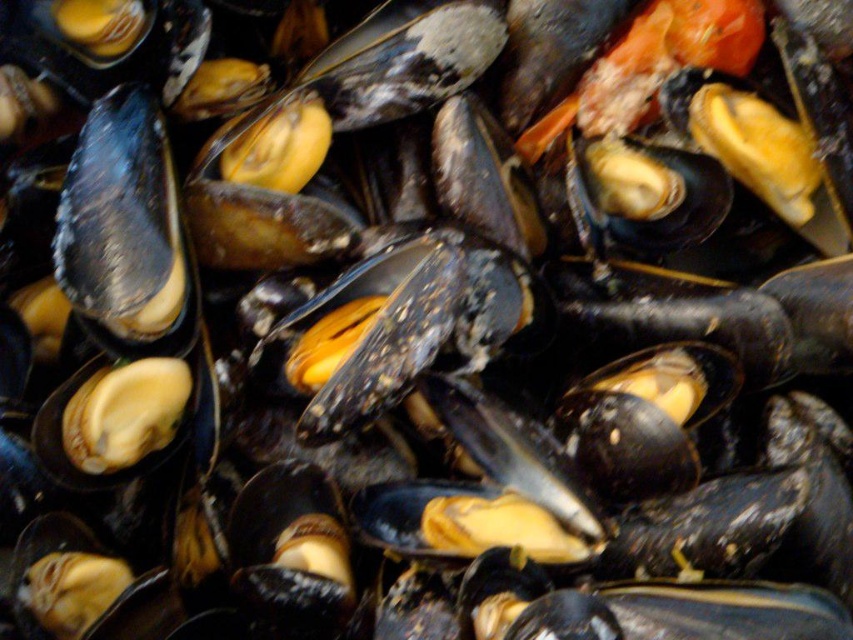
Question: Can you confirm if matte black mussel at upper left is smaller than matte yellow shell at center?

Choices:
 (A) no
 (B) yes

Answer: (A)

Question: Which object appears farthest from the camera in this image?

Choices:
 (A) matte yellow shell at center
 (B) matte black mussel at upper left

Answer: (A)

Question: Which point is closer to the camera?

Choices:
 (A) matte black mussel at upper left
 (B) matte yellow shell at center

Answer: (A)

Question: Is matte black mussel at upper left behind matte yellow shell at center?

Choices:
 (A) yes
 (B) no

Answer: (B)

Question: Can you confirm if matte black mussel at upper left is positioned to the left of matte yellow shell at center?

Choices:
 (A) yes
 (B) no

Answer: (A)

Question: Which object is closer to the camera taking this photo?

Choices:
 (A) matte black mussel at upper left
 (B) matte yellow shell at center

Answer: (A)